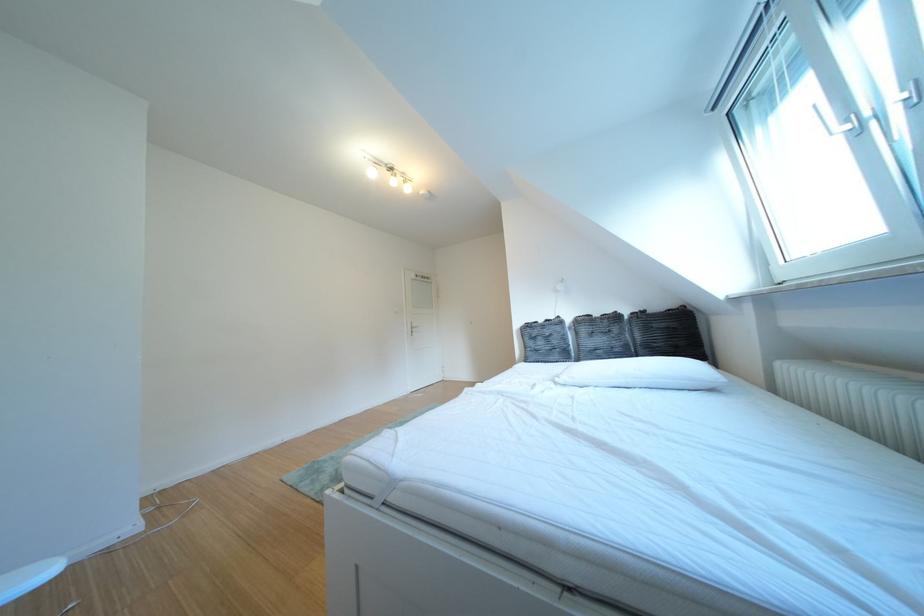
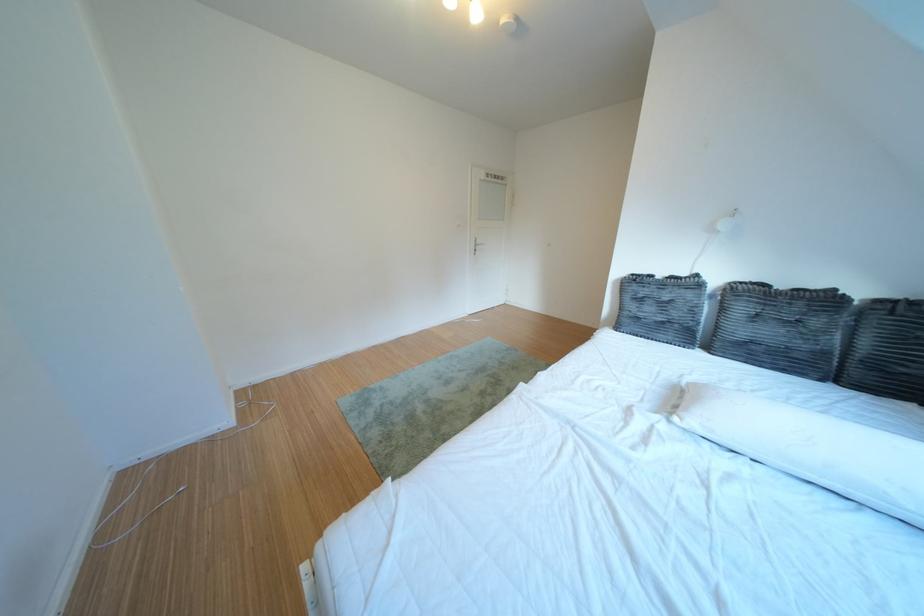
The point at (542, 355) is marked in the first image. Where is the corresponding point in the second image?

(639, 318)